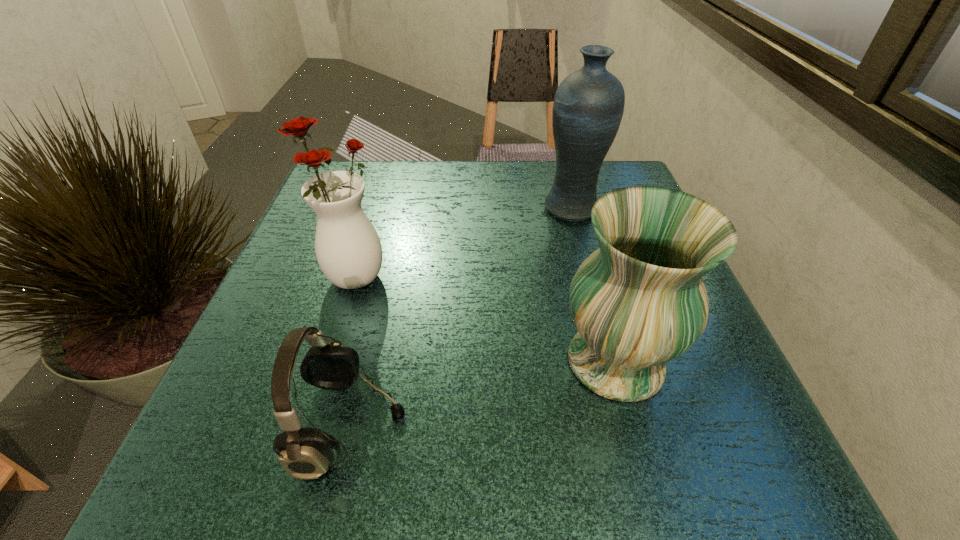
Locate an element on the screen. Image resolution: width=960 pixels, height=540 pixels. object positioned at the near edge is located at coordinates (305, 453).

Locate an element on the screen. This screenshot has width=960, height=540. vase located in the left edge section of the desktop is located at coordinates (348, 249).

Locate an element on the screen. The height and width of the screenshot is (540, 960). headset that is at the left edge is located at coordinates (305, 453).

Where is `object that is positioned at the near left corner`? object that is positioned at the near left corner is located at coordinates (305, 453).

Where is `object situated at the far right corner`? object situated at the far right corner is located at coordinates (588, 106).

You are a GUI agent. You are given a task and a screenshot of the screen. Output one action in this format:
    pyautogui.click(x=<x>, y=<y>)
    Task: Click on the vacant space at the far edge
    
    Given the screenshot: What is the action you would take?
    pyautogui.click(x=489, y=193)

Where is `free space at the near edge of the desktop`? free space at the near edge of the desktop is located at coordinates (463, 476).

Locate an element on the screen. vacant region at the left edge of the desktop is located at coordinates (324, 297).

Locate an element on the screen. This screenshot has width=960, height=540. vacant space at the near left corner is located at coordinates (252, 452).

Identify the location of blank space at the far right corner. This screenshot has width=960, height=540. (620, 163).